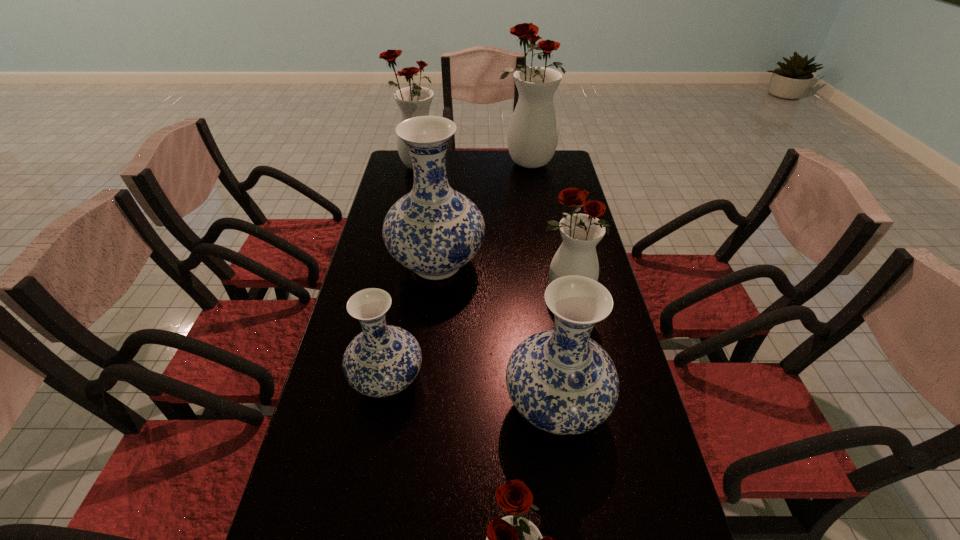
The height and width of the screenshot is (540, 960). What are the coordinates of `vacant region that satisfies the following two spatial constraints: 1. on the front side of the second smallest red vase; 2. on the right side of the farthest blue vase` in the screenshot? It's located at (434, 292).

In order to click on vacant space that satisfies the following two spatial constraints: 1. on the back side of the biggest blue vase; 2. on the left side of the biggest red vase in this screenshot , I will do `click(448, 163)`.

The width and height of the screenshot is (960, 540). I want to click on free point that satisfies the following two spatial constraints: 1. on the front side of the biggest blue vase; 2. on the right side of the leftmost red vase, so click(x=397, y=264).